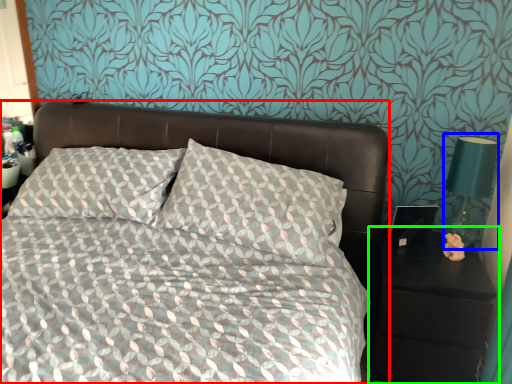
Question: Estimate the real-world distances between objects in this image. Which object is farther from bed (highlighted by a red box), bedside lamp (highlighted by a blue box) or nightstand (highlighted by a green box)?

Choices:
 (A) bedside lamp
 (B) nightstand

Answer: (A)